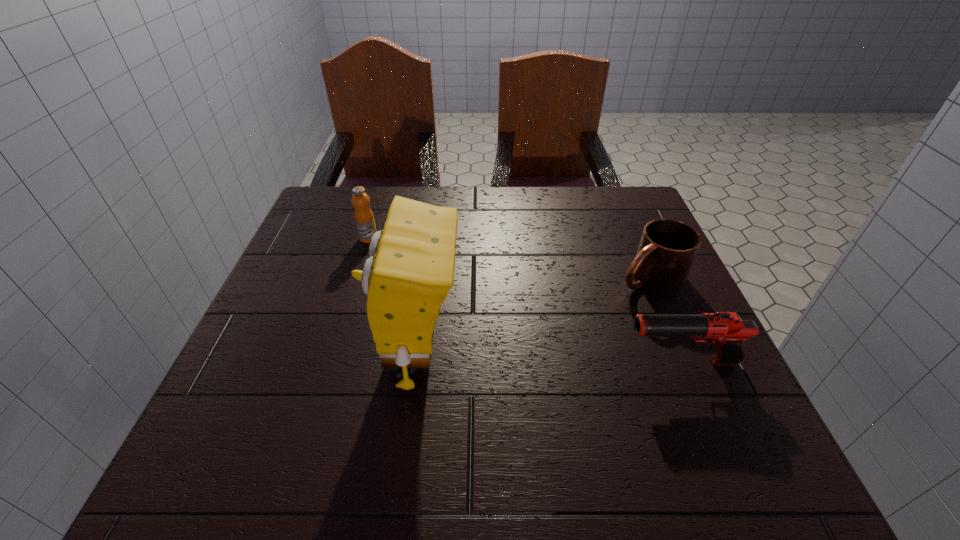
At what (x,y) coordinates should I click in order to perform the action: click on sponge. Please return your answer as a coordinate pair (x, y). Looking at the image, I should click on coord(410,271).

The height and width of the screenshot is (540, 960). I want to click on the tallest object, so click(x=410, y=271).

Find the location of `gun`. gun is located at coordinates (727, 331).

You are a GUI agent. You are given a task and a screenshot of the screen. Output one action in this format:
    pyautogui.click(x=<x>, y=<y>)
    Task: Click on the second farthest object
    Image resolution: width=960 pixels, height=540 pixels.
    Given the screenshot: What is the action you would take?
    point(667,248)

Find the location of a particular element. This screenshot has height=540, width=960. the farthest object is located at coordinates (364, 218).

Find the location of a particular element. Image resolution: width=960 pixels, height=540 pixels. orange juice is located at coordinates (364, 218).

Find the location of a particular element. vacant space located on the face of the tallest object is located at coordinates (303, 357).

Image resolution: width=960 pixels, height=540 pixels. I want to click on vacant space located on the face of the tallest object, so click(x=341, y=357).

At what (x,y) coordinates should I click in order to perform the action: click on vacant space located at the aiming end of the gun. Please return your answer as a coordinate pair (x, y). Looking at the image, I should click on (555, 363).

Identify the location of vacant area situated at the aiming end of the gun. This screenshot has height=540, width=960. (480, 363).